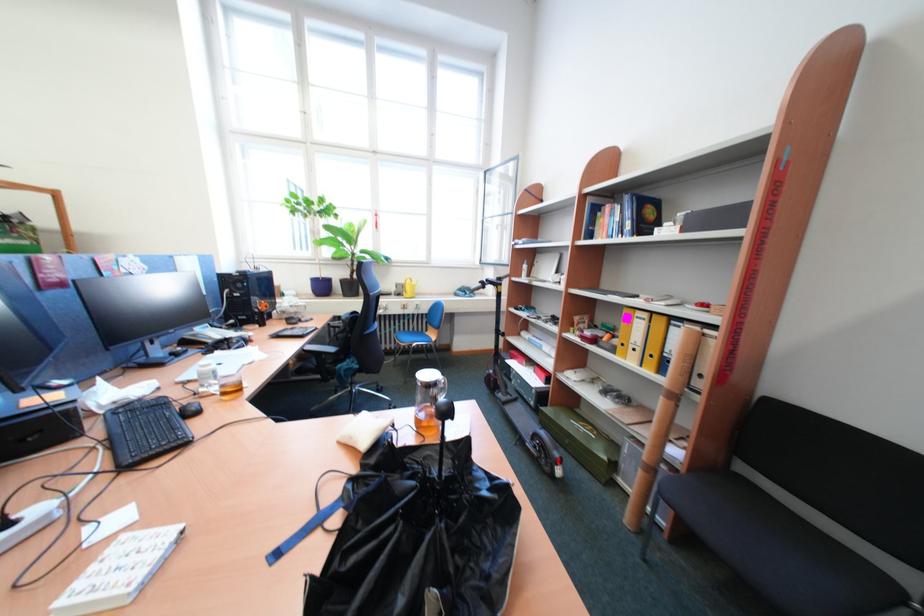
Find the location of a particular element. black umbrella handle is located at coordinates (444, 408).